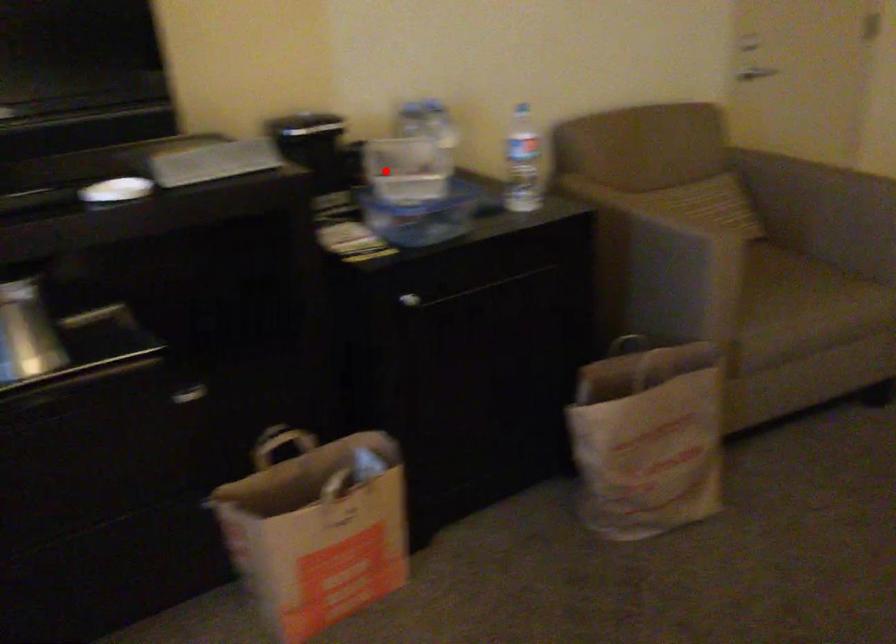
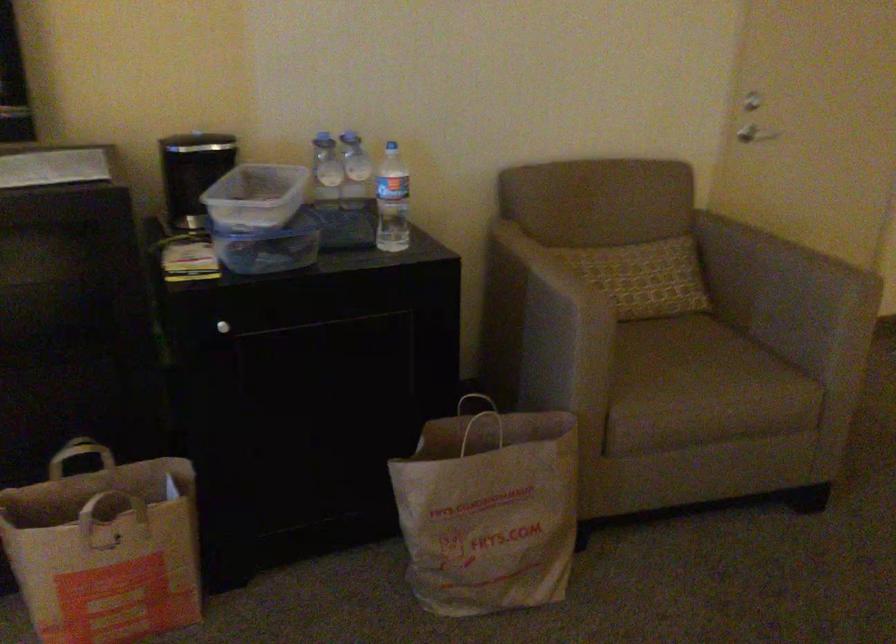
The point at the highlighted location is marked in the first image. Where is the corresponding point in the second image?

(255, 196)